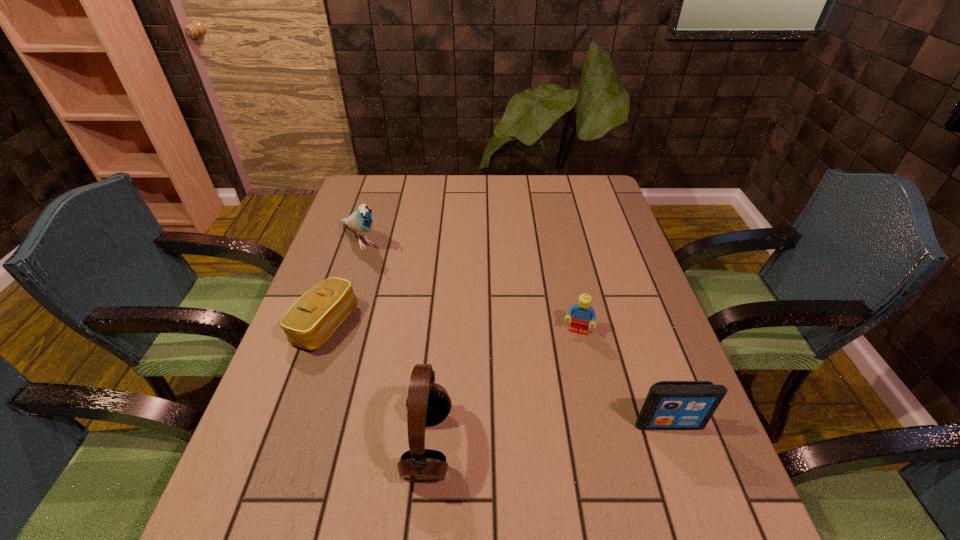
Identify the location of headset. (428, 403).

The image size is (960, 540). Find the location of `the rightmost object`. the rightmost object is located at coordinates (670, 405).

In order to click on the fourth object from left to right in this screenshot , I will do `click(582, 313)`.

The image size is (960, 540). What are the coordinates of `bird` in the screenshot? It's located at (360, 221).

Find the location of `the shortest object`. the shortest object is located at coordinates (311, 320).

You are a GUI agent. You are given a task and a screenshot of the screen. Output one action in this format:
    pyautogui.click(x=<x>, y=<y>)
    Task: Click on the vacant space located 0.100m on the ear pads of the third object from left to right
    Image resolution: width=960 pixels, height=540 pixels.
    Given the screenshot: What is the action you would take?
    pyautogui.click(x=354, y=446)

In order to click on vacant space located 0.190m on the ear pads of the third object from left to right in this screenshot , I will do `click(308, 446)`.

The image size is (960, 540). What are the coordinates of `vacant space positioned on the ear pads of the third object from left to right` in the screenshot? It's located at (369, 446).

Image resolution: width=960 pixels, height=540 pixels. Identify the location of vacant space located 0.200m on the face of the Lego. (558, 409).

At what (x,y) coordinates should I click in order to perform the action: click on vacant space located 0.260m on the face of the Lego. Please return your answer as a coordinate pair (x, y). This screenshot has width=960, height=540. Looking at the image, I should click on (551, 434).